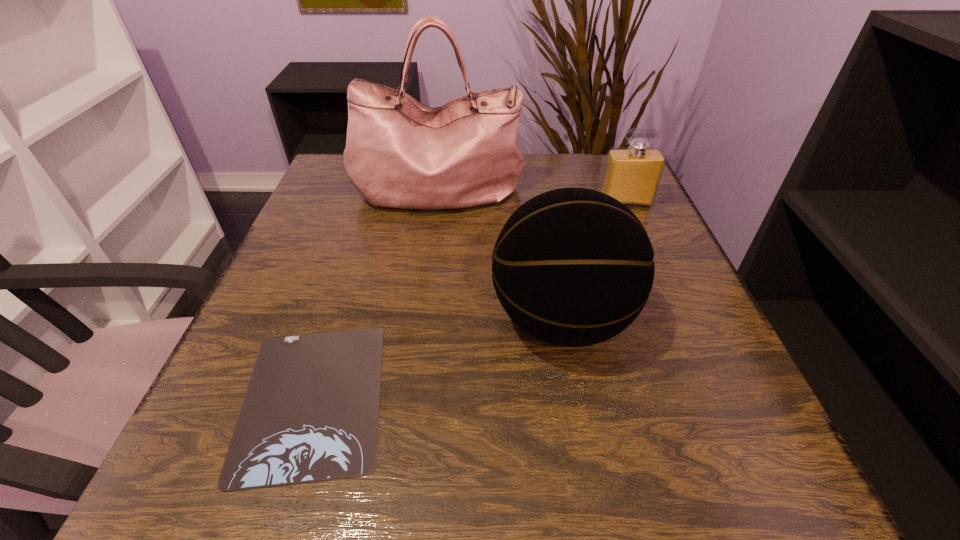
Locate an element on the screen. The height and width of the screenshot is (540, 960). free point that satisfies the following two spatial constraints: 1. at the front of the tallest object with handles; 2. on the left side of the second tallest object is located at coordinates (421, 320).